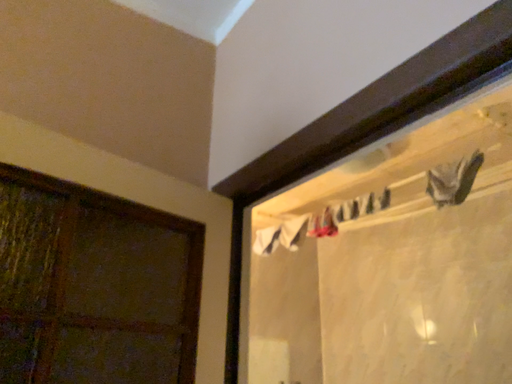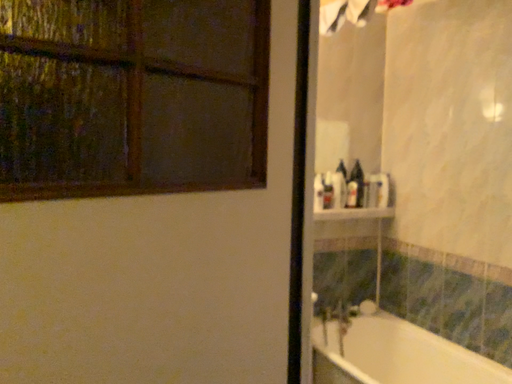
Question: Which way did the camera rotate in the video?

Choices:
 (A) rotated left
 (B) rotated right

Answer: (A)